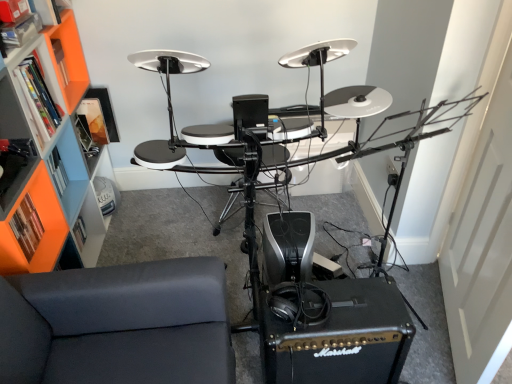
Question: Considering the relative sizes of orange plastic bookshelf at left and orange matte bookshelf at left, which is the 2th shelf from top to bottom, in the image provided, is orange plastic bookshelf at left thinner than orange matte bookshelf at left, which is the 2th shelf from top to bottom,?

Choices:
 (A) no
 (B) yes

Answer: (A)

Question: Does orange plastic bookshelf at left lie behind orange matte bookshelf at left, which is the first shelf from bottom to top?

Choices:
 (A) no
 (B) yes

Answer: (A)

Question: Is orange plastic bookshelf at left not inside orange matte bookshelf at left, which is the first shelf from bottom to top?

Choices:
 (A) yes
 (B) no

Answer: (A)

Question: Are orange plastic bookshelf at left and orange matte bookshelf at left, which is the first shelf from bottom to top, far apart?

Choices:
 (A) yes
 (B) no

Answer: (B)

Question: Is orange plastic bookshelf at left smaller than orange matte bookshelf at left, which is the first shelf from bottom to top?

Choices:
 (A) yes
 (B) no

Answer: (B)

Question: Is orange plastic bookshelf at left positioned before orange matte bookshelf at left, which is the first shelf from bottom to top?

Choices:
 (A) yes
 (B) no

Answer: (A)

Question: From a real-world perspective, is orange matte bookshelf at left, which is the first shelf from bottom to top, below dark gray fabric couch at lower left?

Choices:
 (A) no
 (B) yes

Answer: (A)

Question: Is orange matte bookshelf at left, which is the 2th shelf from top to bottom, thinner than dark gray fabric couch at lower left?

Choices:
 (A) yes
 (B) no

Answer: (A)

Question: Is orange matte bookshelf at left, which is the 2th shelf from top to bottom, facing towards dark gray fabric couch at lower left?

Choices:
 (A) no
 (B) yes

Answer: (A)

Question: Considering the relative sizes of orange matte bookshelf at left, which is the first shelf from bottom to top, and dark gray fabric couch at lower left in the image provided, is orange matte bookshelf at left, which is the first shelf from bottom to top, taller than dark gray fabric couch at lower left?

Choices:
 (A) yes
 (B) no

Answer: (B)

Question: Is orange matte bookshelf at left, which is the first shelf from bottom to top, turned away from dark gray fabric couch at lower left?

Choices:
 (A) no
 (B) yes

Answer: (A)

Question: Considering the relative sizes of orange matte bookshelf at left, which is the 2th shelf from top to bottom, and dark gray fabric couch at lower left in the image provided, is orange matte bookshelf at left, which is the 2th shelf from top to bottom, smaller than dark gray fabric couch at lower left?

Choices:
 (A) no
 (B) yes

Answer: (B)

Question: Is orange matte bookshelf at left, which is the 2th shelf from top to bottom, oriented towards orange plastic bookshelf at left?

Choices:
 (A) yes
 (B) no

Answer: (A)